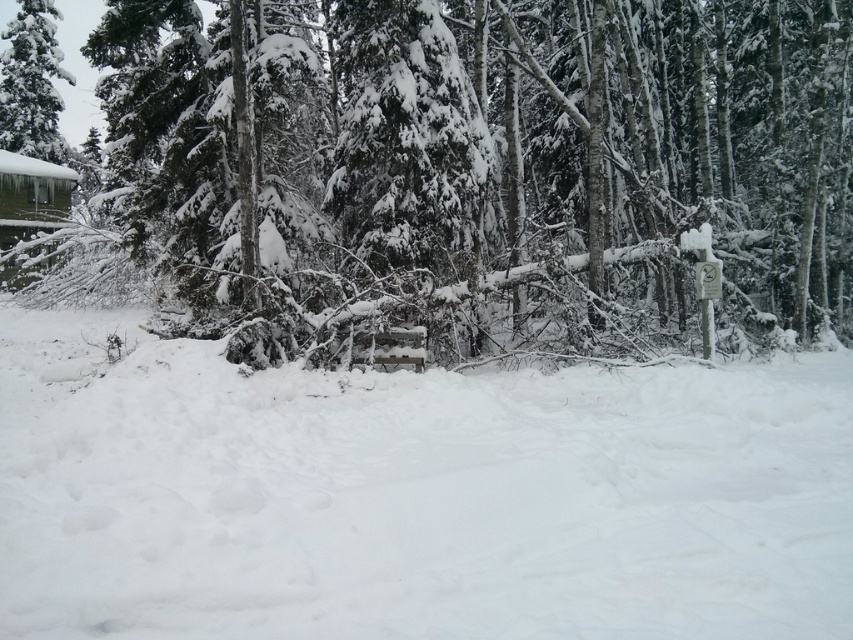
In the scene shown: You are standing in the winter forest scene and want to walk from the point at coordinates (372,74) to the point at coordinates (36,64). Which direction should you move to get closer to your destination?

To move from point (372,74) to point (36,64), you should move downward and to the left because the destination point is lower and further left on the coordinate plane compared to the starting point.